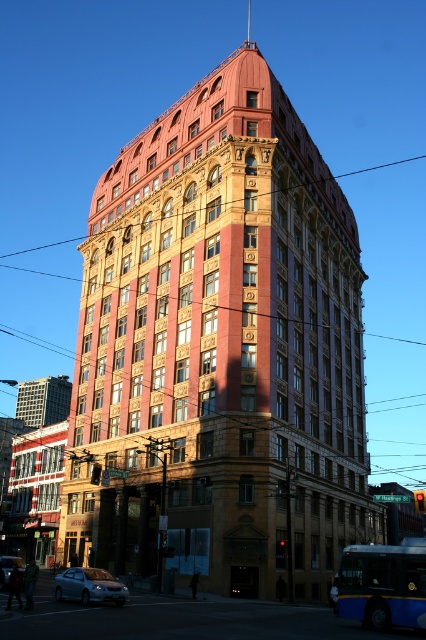
Question: Is blue metallic bus at lower right further to camera compared to satin silver sedan at lower left?

Choices:
 (A) no
 (B) yes

Answer: (A)

Question: Which of the following is the farthest from the observer?

Choices:
 (A) (115, 584)
 (B) (11, 561)
 (C) (365, 596)

Answer: (B)

Question: Is satin silver sedan at lower left further to the viewer compared to silver metallic sedan at lower left?

Choices:
 (A) yes
 (B) no

Answer: (B)

Question: Where is blue metallic bus at lower right located in relation to silver metallic sedan at lower left in the image?

Choices:
 (A) right
 (B) left

Answer: (A)

Question: Which of the following is the closest to the observer?

Choices:
 (A) blue metallic bus at lower right
 (B) satin silver sedan at lower left
 (C) silver metallic sedan at lower left

Answer: (A)

Question: Which of these objects is positioned closest to the silver metallic sedan at lower left?

Choices:
 (A) blue metallic bus at lower right
 (B) satin silver sedan at lower left

Answer: (B)